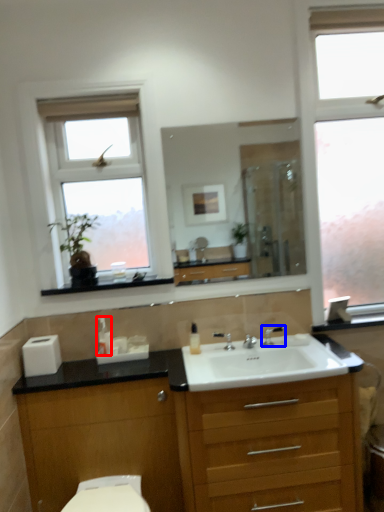
Question: Which point is closer to the camera, soap dispenser (highlighted by a red box) or tap (highlighted by a blue box)?

Choices:
 (A) soap dispenser
 (B) tap

Answer: (A)